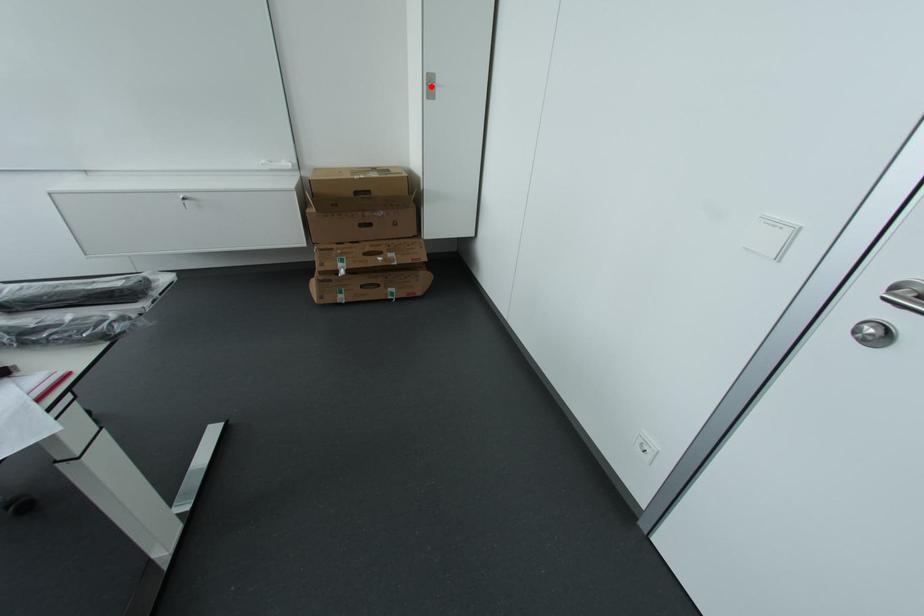
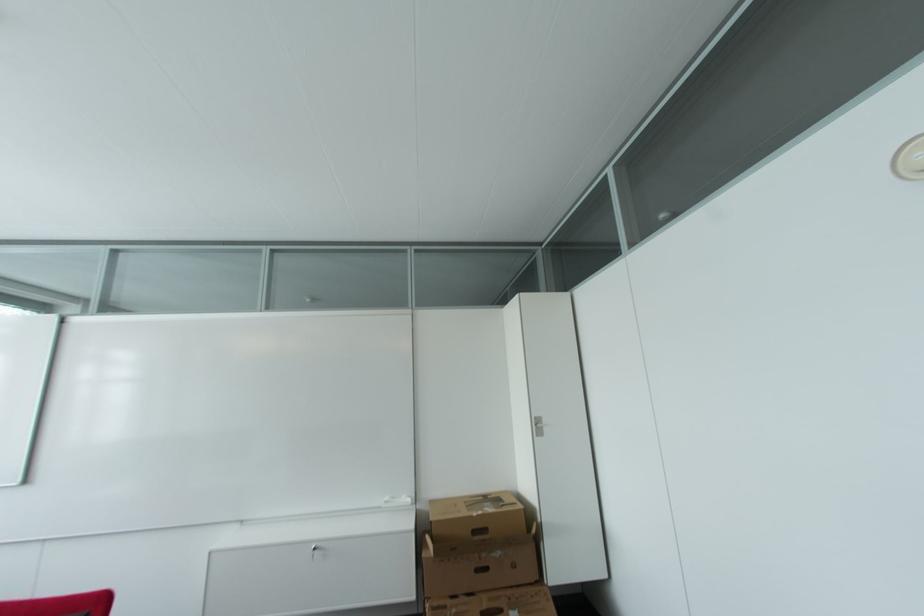
The point at the highlighted location is marked in the first image. Where is the corresponding point in the second image?

(540, 426)